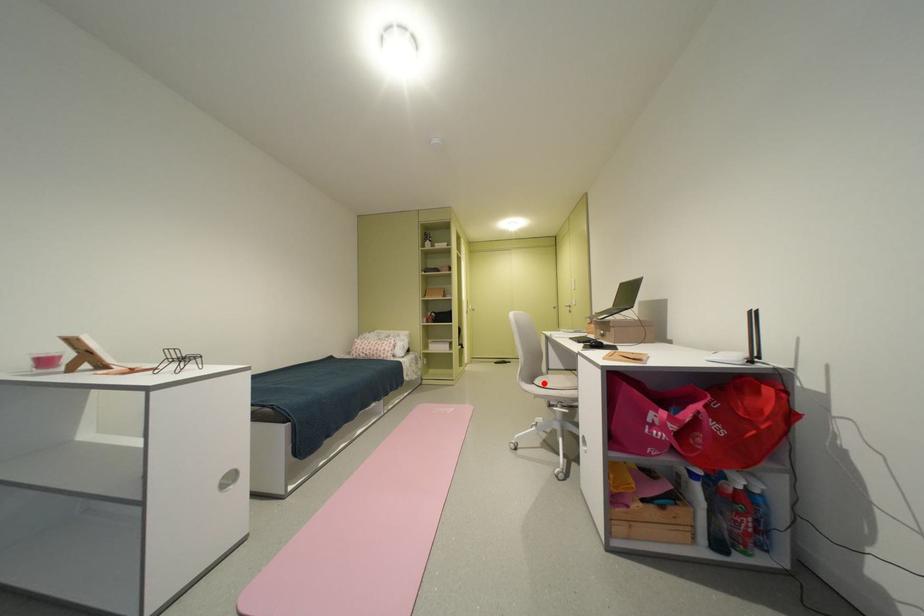
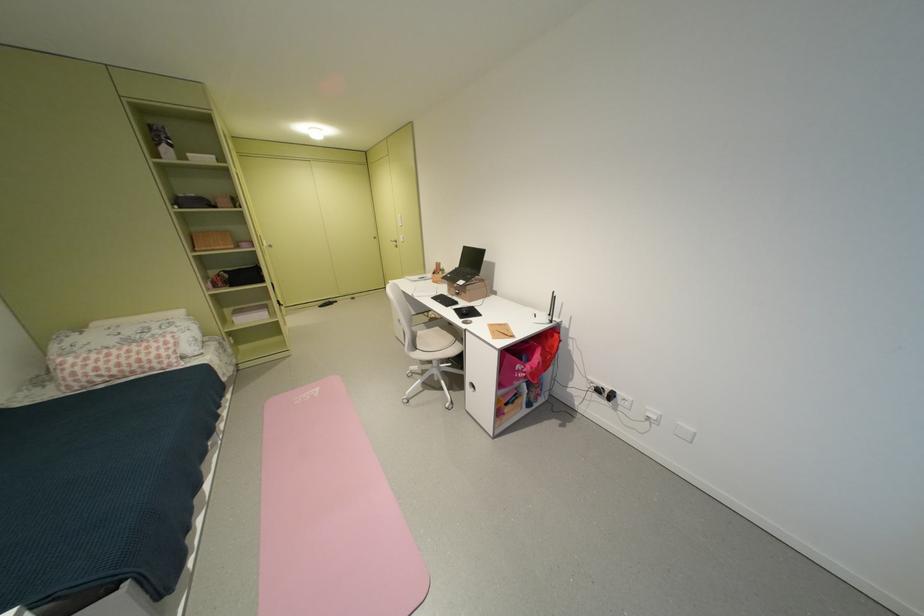
In the second image, find the point that corresponds to the highlighted location in the first image.

(428, 349)